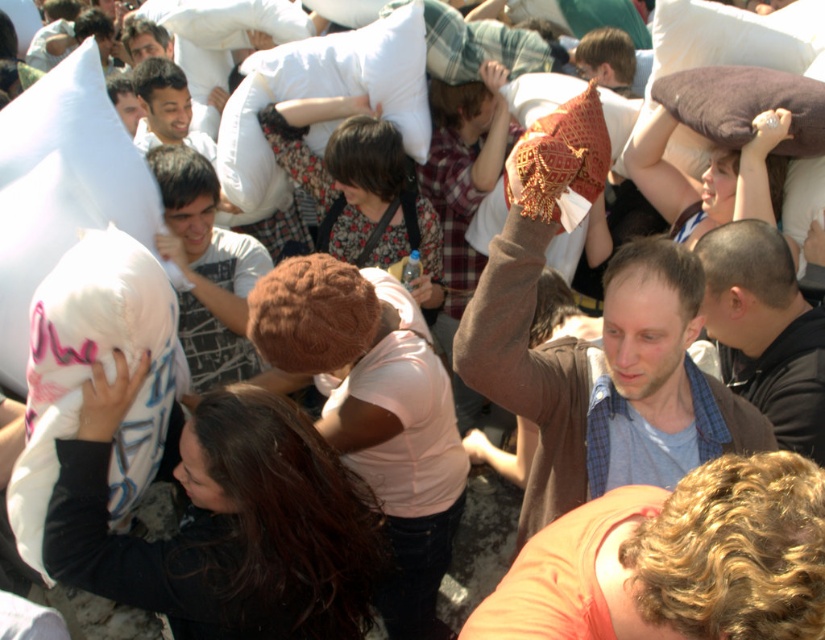
Question: Which object is farther from the camera taking this photo?

Choices:
 (A) white cotton shirt at center
 (B) dark gray jacket at center

Answer: (A)

Question: Is white cotton shirt at center to the right of brown soft pillow at upper right from the viewer's perspective?

Choices:
 (A) no
 (B) yes

Answer: (A)

Question: Does white cotton shirt at center come behind brown soft pillow at upper right?

Choices:
 (A) yes
 (B) no

Answer: (B)

Question: Estimate the real-world distances between objects in this image. Which object is closer to the white cotton shirt at center?

Choices:
 (A) dark gray jacket at center
 (B) brown textured sweater at upper right
 (C) brown soft pillow at upper right

Answer: (B)

Question: Which object is farther from the camera taking this photo?

Choices:
 (A) brown textured sweater at upper right
 (B) dark gray jacket at center

Answer: (B)

Question: Is brown textured sweater at upper right smaller than white soft pillow at upper center?

Choices:
 (A) yes
 (B) no

Answer: (A)